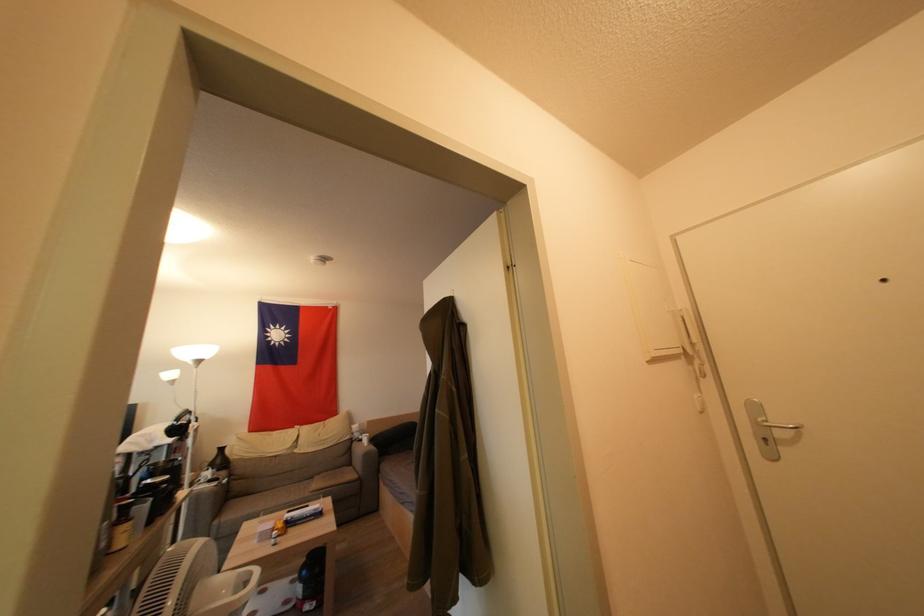
Where would you leaning on the sofa armrest? Please return your answer as a coordinate pair (x, y).

(366, 504)